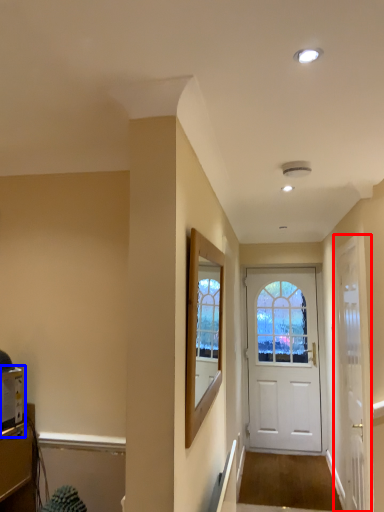
Question: Which point is further to the camera, door (highlighted by a red box) or appliance (highlighted by a blue box)?

Choices:
 (A) door
 (B) appliance

Answer: (A)